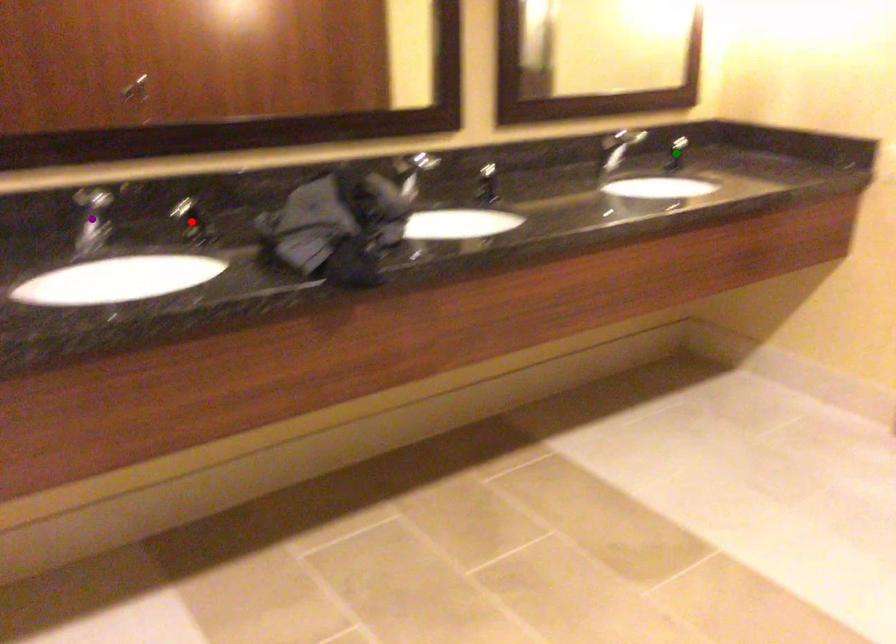
Order these from nearest to farthest:
A) red point
B) purple point
C) green point

1. purple point
2. red point
3. green point